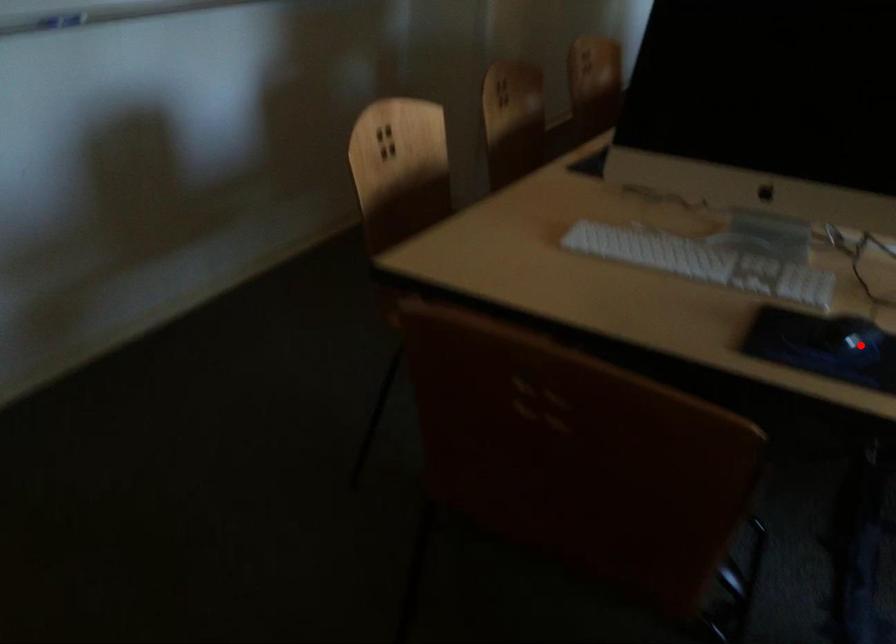
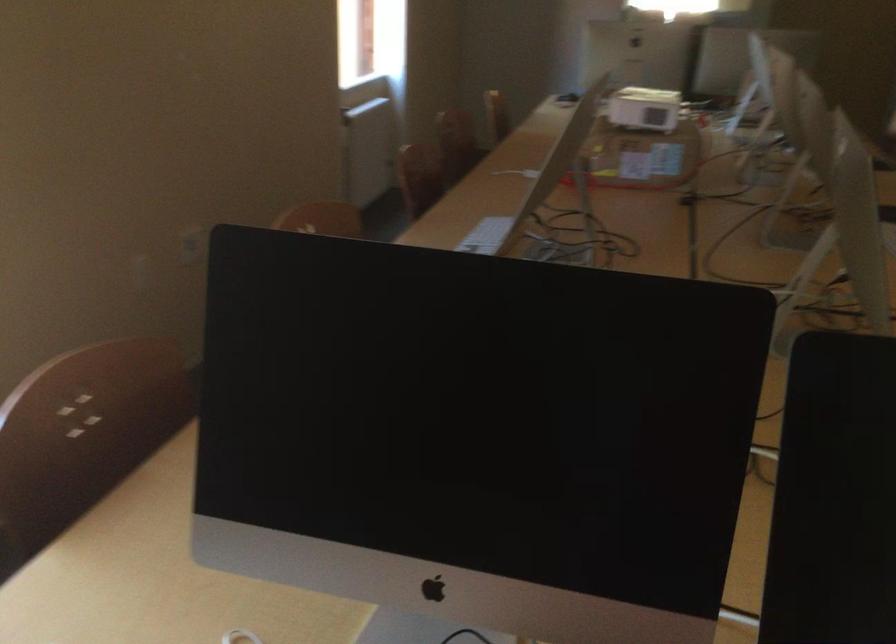
Question: I am providing you with two images of the same scene from different viewpoints. A red point is marked on the first image. Is the red point's position out of view in image 2?

Choices:
 (A) Yes
 (B) No

Answer: (A)